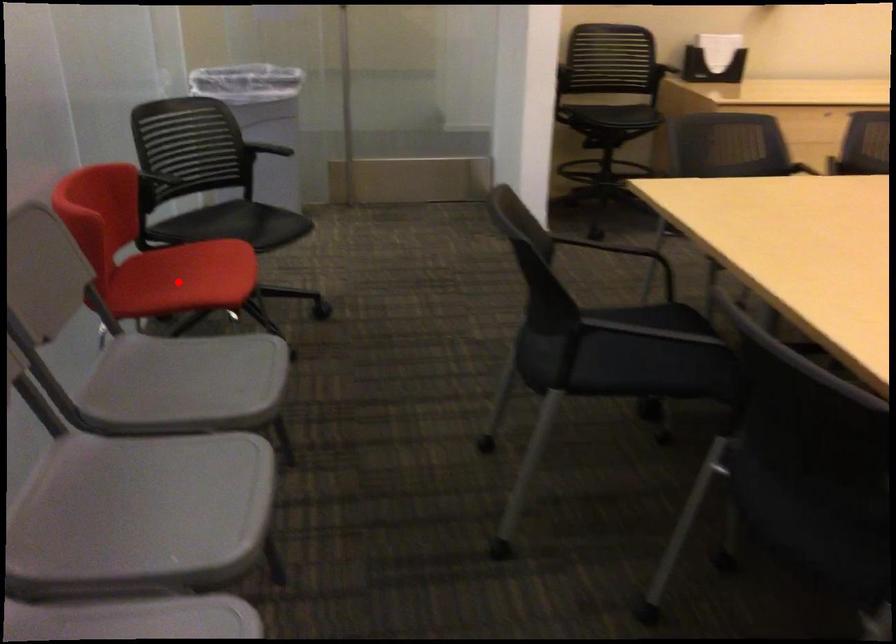
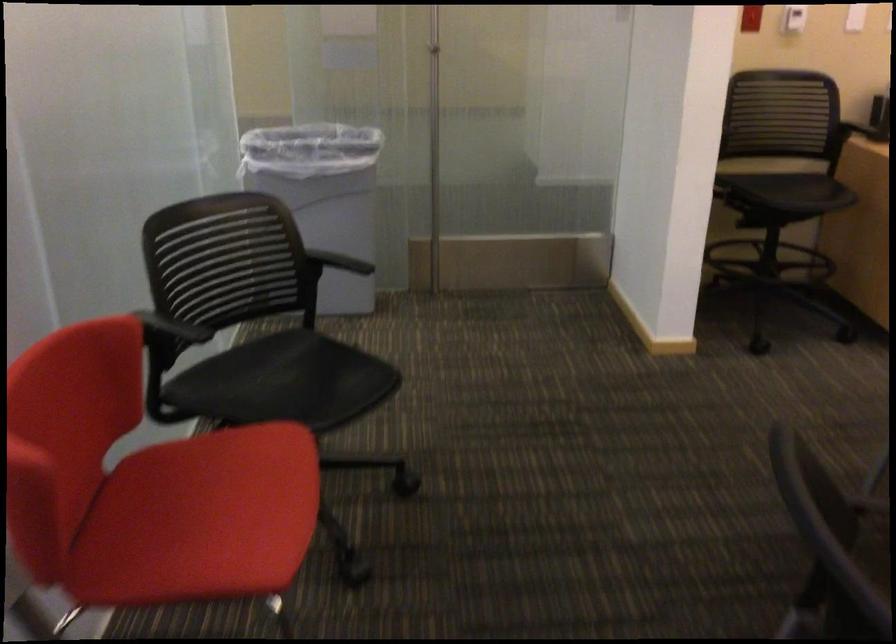
Question: I am providing you with two images of the same scene from different viewpoints. A red point is shown in image1. For the corresponding object point in image2, is it positioned nearer or farther from the camera?

Choices:
 (A) Nearer
 (B) Farther

Answer: (A)